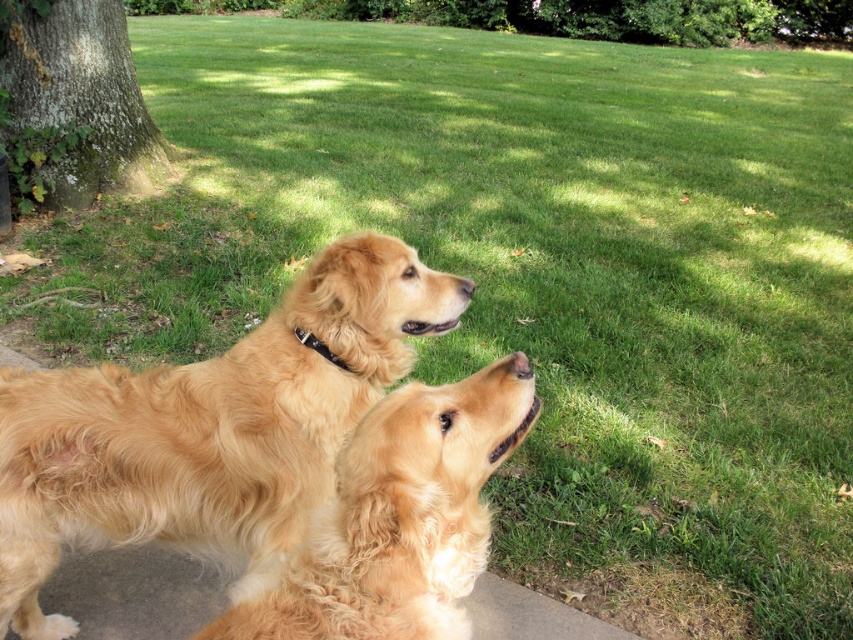
Question: Can you confirm if golden fur dog at upper left is bigger than golden fluffy dog at center?

Choices:
 (A) no
 (B) yes

Answer: (B)

Question: Considering the relative positions of golden fur dog at upper left and green mossy bark at left in the image provided, where is golden fur dog at upper left located with respect to green mossy bark at left?

Choices:
 (A) below
 (B) above

Answer: (A)

Question: Which object is the farthest from the golden fluffy dog at center?

Choices:
 (A) golden fur dog at upper left
 (B) green mossy bark at left

Answer: (B)

Question: Which point is farther from the camera taking this photo?

Choices:
 (A) (305, 344)
 (B) (502, 371)
 (C) (219, 476)

Answer: (C)

Question: Is golden fur dog at upper left wider than black leather neckband at upper center?

Choices:
 (A) no
 (B) yes

Answer: (B)

Question: Estimate the real-world distances between objects in this image. Which object is farther from the green mossy bark at left?

Choices:
 (A) golden fluffy dog at center
 (B) golden fur dog at upper left
 (C) black leather neckband at upper center

Answer: (A)